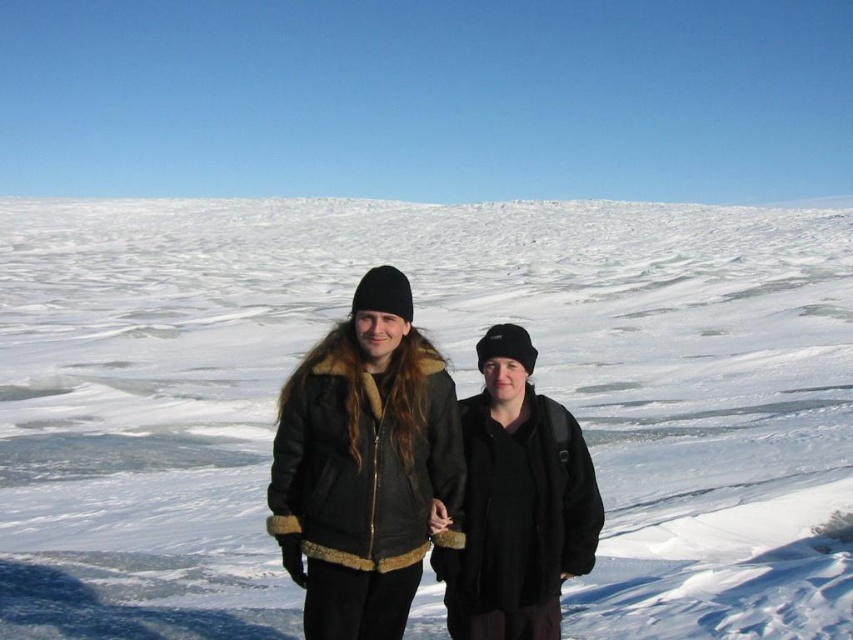
Does point (167, 314) lie behind point (474, 634)?

Yes, it is.

Can you confirm if white fluffy snow at center is shorter than black matte jacket at center?

Incorrect, white fluffy snow at center's height does not fall short of black matte jacket at center's.

Which is in front, point (227, 333) or point (503, 349)?

Positioned in front is point (503, 349).

In order to click on white fluffy snow at center in this screenshot , I will do `click(457, 388)`.

Can you confirm if leather jacket at center is bigger than black matte jacket at center?

Actually, leather jacket at center might be smaller than black matte jacket at center.

Where is `leather jacket at center`? The image size is (853, 640). leather jacket at center is located at coordinates (366, 465).

You are a GUI agent. You are given a task and a screenshot of the screen. Output one action in this format:
    pyautogui.click(x=<x>, y=<y>)
    Task: Click on the leather jacket at center
    
    Given the screenshot: What is the action you would take?
    click(x=366, y=465)

Is white fluffy snow at center behind leather jacket at center?

Yes, it is.

In the scene shown: Is white fluffy snow at center wider than leather jacket at center?

Yes, white fluffy snow at center is wider than leather jacket at center.

Describe the element at coordinates (457, 388) in the screenshot. Image resolution: width=853 pixels, height=640 pixels. I see `white fluffy snow at center` at that location.

Where is `white fluffy snow at center`? The image size is (853, 640). white fluffy snow at center is located at coordinates (457, 388).